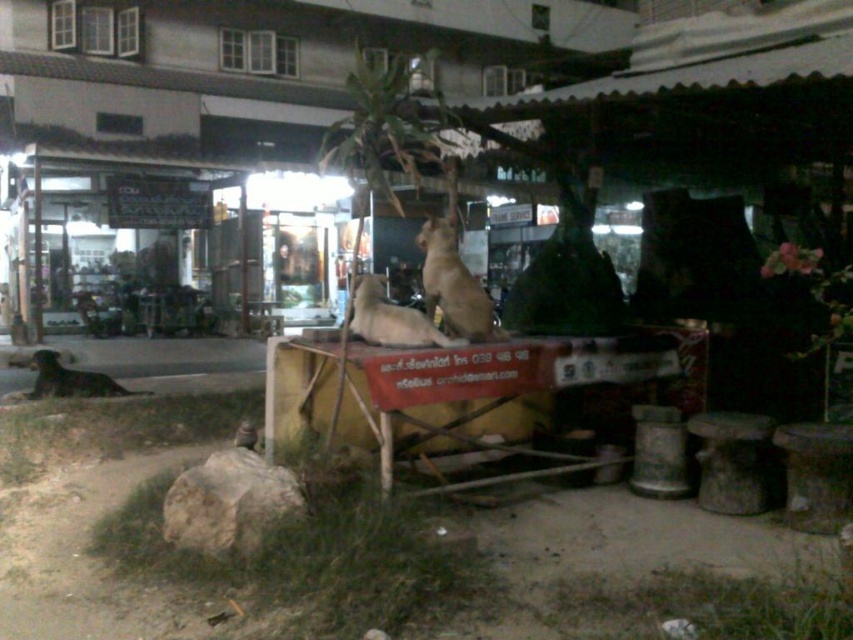
You are standing at the center of the image. There is a point marked at coordinates point (451, 284). What object is located at that point?

The point (451, 284) indicates the brown fur dog at center.

You are standing at the camera position and want to throw a ball to the brown fur dog at center. If the ball travels in a straight line, how far will it travel before reaching the dog?

The ball will travel 14.74 feet to reach the brown fur dog at center since the distance from the camera to the dog is 14.74 feet.

You are a delivery robot with a 2 meter long package. You need to move from the brown fur dog at lower left to the brown fur dog at center. Can you fit the package between them without moving either dog?

The distance between the brown fur dog at center and the brown fur dog at lower left is 4.71 meters. Since the package is 2 meters long, it can easily fit between them as there is sufficient space.